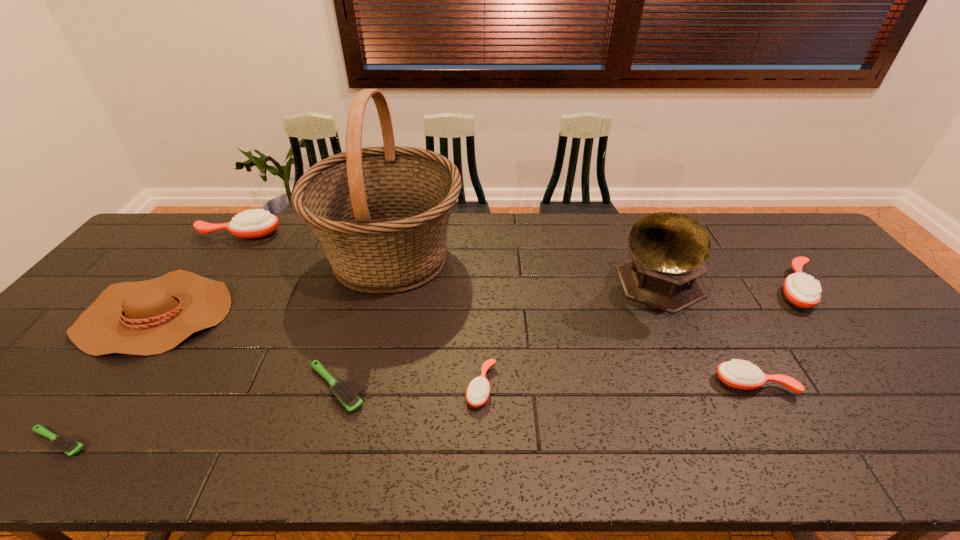
Where is `the tallest object`? This screenshot has width=960, height=540. the tallest object is located at coordinates (381, 214).

I want to click on the second tallest object, so click(668, 249).

Identify the location of the biggest orange hairbrush. This screenshot has width=960, height=540. (252, 223).

I want to click on the leftmost orange hairbrush, so click(252, 223).

Where is `cowboy hat`? The width and height of the screenshot is (960, 540). cowboy hat is located at coordinates (150, 317).

Where is `the second farthest orange hairbrush`? the second farthest orange hairbrush is located at coordinates (802, 290).

Image resolution: width=960 pixels, height=540 pixels. What are the coordinates of `the fifth nearest hairbrush` in the screenshot? It's located at (802, 290).

Identify the location of the fifth hairbrush from left to right. The height and width of the screenshot is (540, 960). (739, 374).

Locate an element on the screen. This screenshot has width=960, height=540. the fourth shortest object is located at coordinates (739, 374).

In order to click on the fourth object from right to left in this screenshot , I will do `click(478, 391)`.